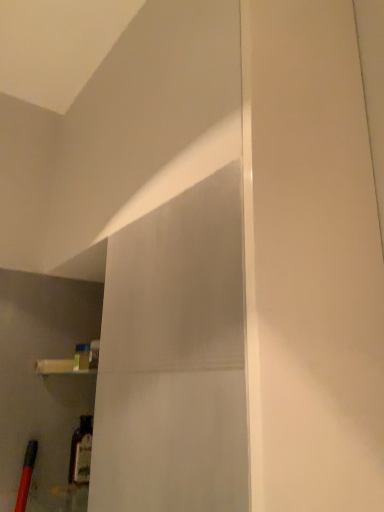
Question: Should I look upward or downward to see translucent glass bottle at lower left?

Choices:
 (A) down
 (B) up

Answer: (A)